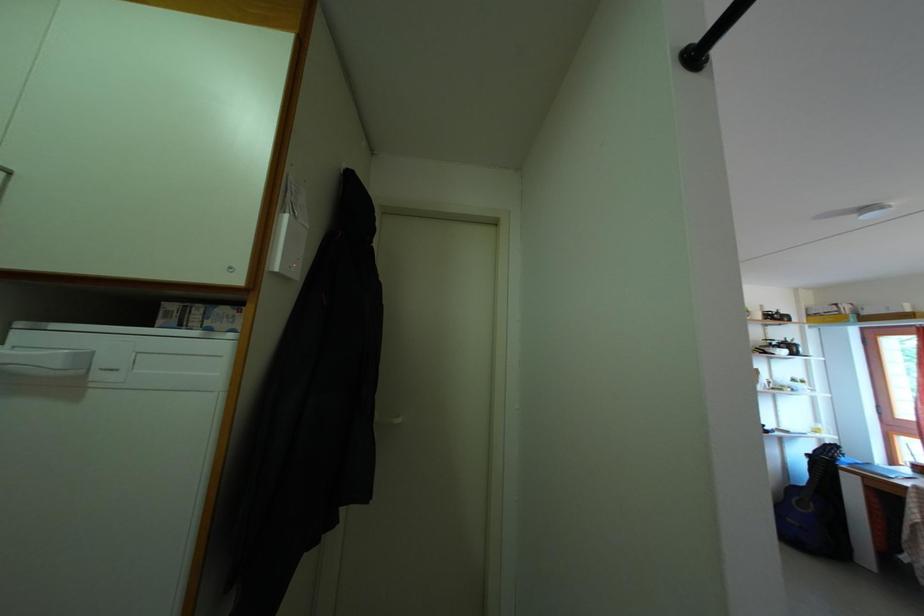
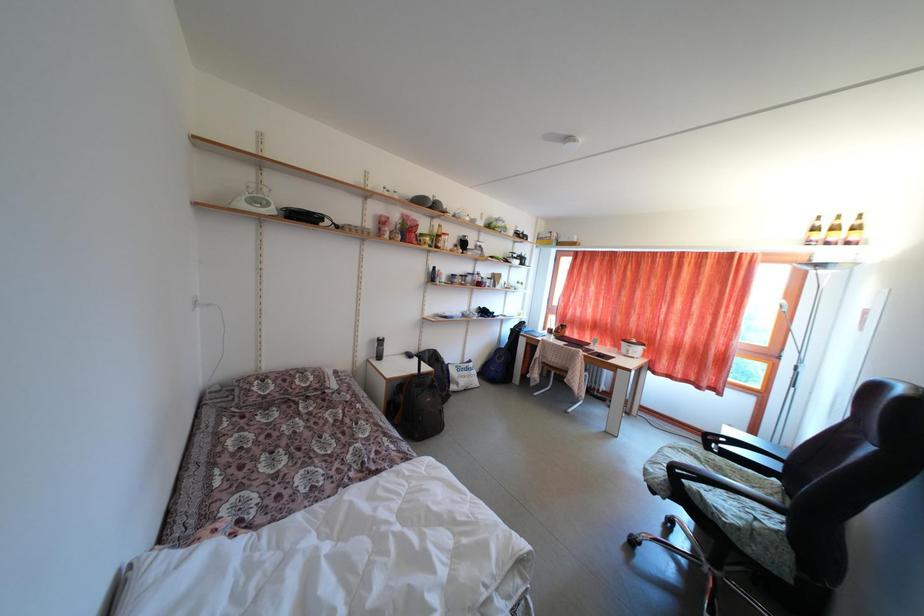
Consider the image. First-person continuous shooting, in which direction is the camera rotating?

The camera rotated toward right-down.